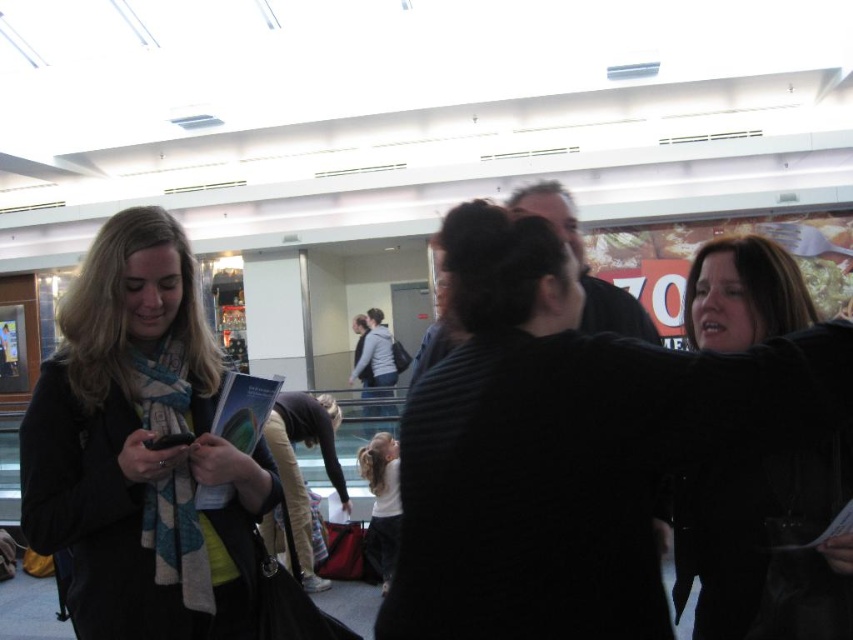
Question: Can you confirm if black matte scarf at left is smaller than black fuzzy coat at right?

Choices:
 (A) yes
 (B) no

Answer: (B)

Question: Which point is closer to the camera?

Choices:
 (A) (372, 531)
 (B) (820, 577)

Answer: (B)

Question: Does black matte scarf at left have a greater width compared to white cotton shirt at center?

Choices:
 (A) yes
 (B) no

Answer: (A)

Question: Which object is the farthest from the black matte scarf at left?

Choices:
 (A) black fuzzy coat at right
 (B) white cotton shirt at center

Answer: (B)

Question: Considering the real-world distances, which object is closest to the black fuzzy coat at right?

Choices:
 (A) white cotton shirt at center
 (B) black matte scarf at left

Answer: (B)

Question: Is black fuzzy coat at right above white cotton shirt at center?

Choices:
 (A) no
 (B) yes

Answer: (B)